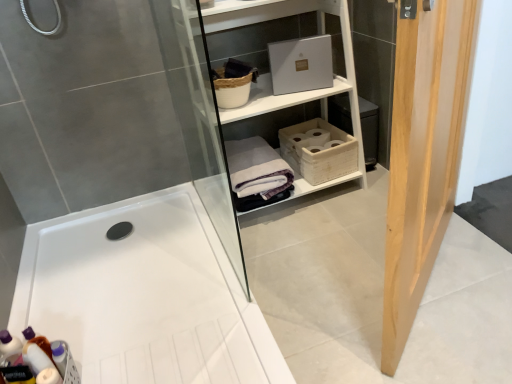
Where is `vacant area that is situated to the right of translucent plastic bottles at lower left`? vacant area that is situated to the right of translucent plastic bottles at lower left is located at coordinates (124, 357).